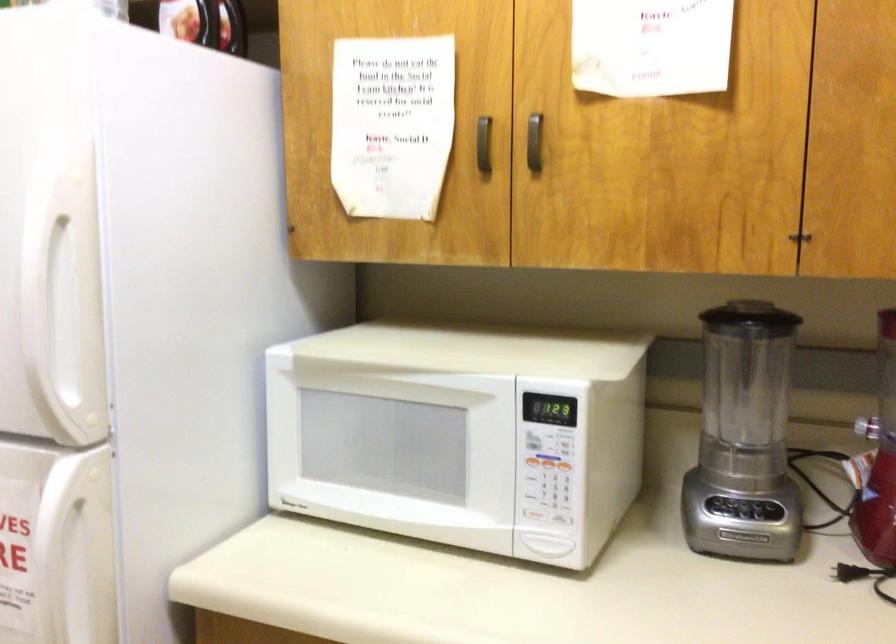
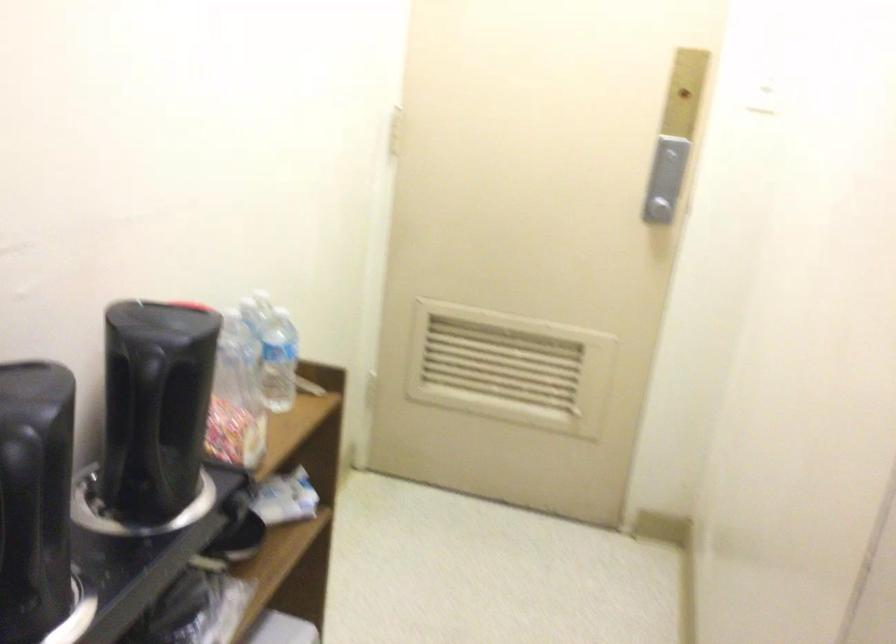
Based on the continuous images, in which direction is the camera rotating?

The camera's rotation is toward left-down.